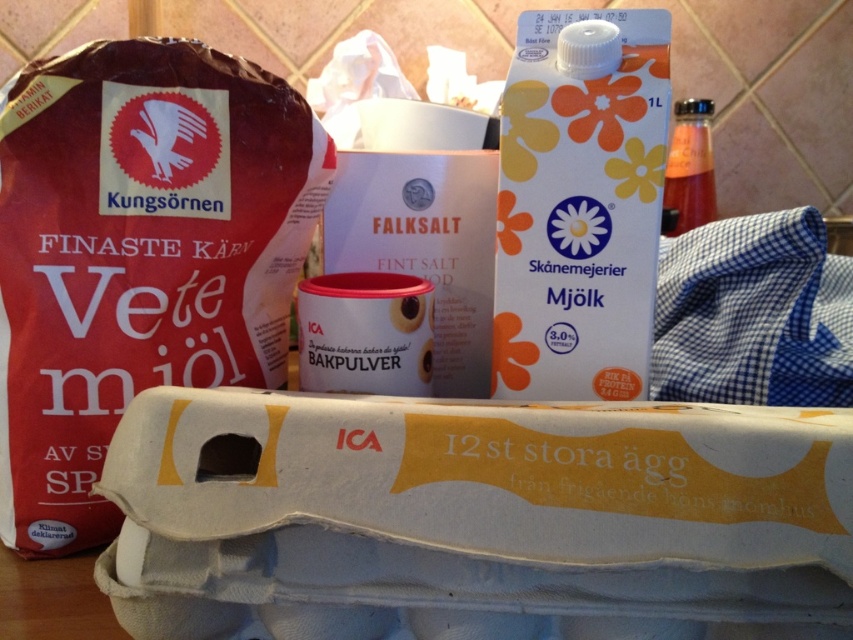
Question: Is brown paper bag at left closer to camera compared to translucent glass bottle at upper right?

Choices:
 (A) no
 (B) yes

Answer: (B)

Question: Which of the following is the farthest from the observer?

Choices:
 (A) translucent glass bottle at upper right
 (B) brown paper bag at left
 (C) white paper milk carton at center

Answer: (A)

Question: Which object appears farthest from the camera in this image?

Choices:
 (A) brown paper bag at left
 (B) translucent glass bottle at upper right
 (C) white paper milk carton at center

Answer: (B)

Question: Is brown paper bag at left bigger than translucent glass bottle at upper right?

Choices:
 (A) no
 (B) yes

Answer: (A)

Question: Which point is closer to the camera?

Choices:
 (A) translucent glass bottle at upper right
 (B) white paper milk carton at center
 (C) brown paper bag at left

Answer: (C)

Question: Does white paper milk carton at center come in front of translucent glass bottle at upper right?

Choices:
 (A) yes
 (B) no

Answer: (A)